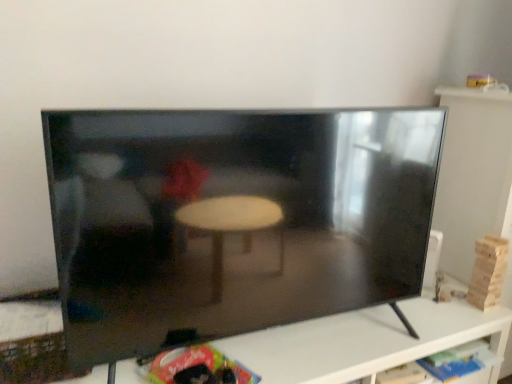
Image resolution: width=512 pixels, height=384 pixels. Identify the location of free space above black glossy tv at center (from a real-world perspective). (326, 337).